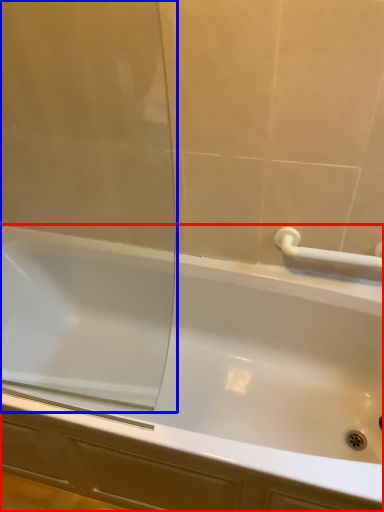
Question: Among these objects, which one is farthest to the camera, bathtub (highlighted by a red box) or screen door (highlighted by a blue box)?

Choices:
 (A) bathtub
 (B) screen door

Answer: (A)